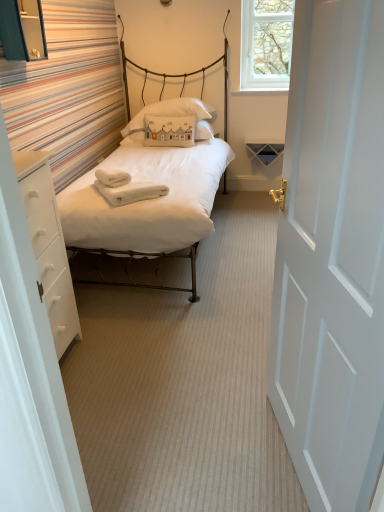
Question: Can we say white fabric pillow at center lies outside white painted wood door at right?

Choices:
 (A) no
 (B) yes

Answer: (B)

Question: From a real-world perspective, is white fabric pillow at center beneath white painted wood door at right?

Choices:
 (A) no
 (B) yes

Answer: (A)

Question: Is white painted wood door at right completely or partially inside white fabric pillow at center?

Choices:
 (A) no
 (B) yes

Answer: (A)

Question: Considering the relative positions of white fabric pillow at center and white painted wood door at right in the image provided, is white fabric pillow at center in front of white painted wood door at right?

Choices:
 (A) yes
 (B) no

Answer: (B)

Question: Can you confirm if white fabric pillow at center is positioned to the right of white painted wood door at right?

Choices:
 (A) no
 (B) yes

Answer: (A)

Question: Is the position of white fabric pillow at center more distant than that of white painted wood door at right?

Choices:
 (A) yes
 (B) no

Answer: (A)

Question: Is clear glass window at upper right closer to camera compared to white matte drawer at left?

Choices:
 (A) yes
 (B) no

Answer: (B)

Question: Is there a large distance between clear glass window at upper right and white matte drawer at left?

Choices:
 (A) yes
 (B) no

Answer: (A)

Question: From a real-world perspective, is clear glass window at upper right located beneath white matte drawer at left?

Choices:
 (A) yes
 (B) no

Answer: (B)

Question: Could you tell me if clear glass window at upper right is facing white matte drawer at left?

Choices:
 (A) no
 (B) yes

Answer: (B)

Question: Is clear glass window at upper right positioned with its back to white matte drawer at left?

Choices:
 (A) yes
 (B) no

Answer: (B)

Question: Considering the relative positions of clear glass window at upper right and white matte drawer at left in the image provided, is clear glass window at upper right to the right of white matte drawer at left from the viewer's perspective?

Choices:
 (A) no
 (B) yes

Answer: (B)

Question: From a real-world perspective, is matte white bed at center on white painted wood door at right?

Choices:
 (A) no
 (B) yes

Answer: (B)